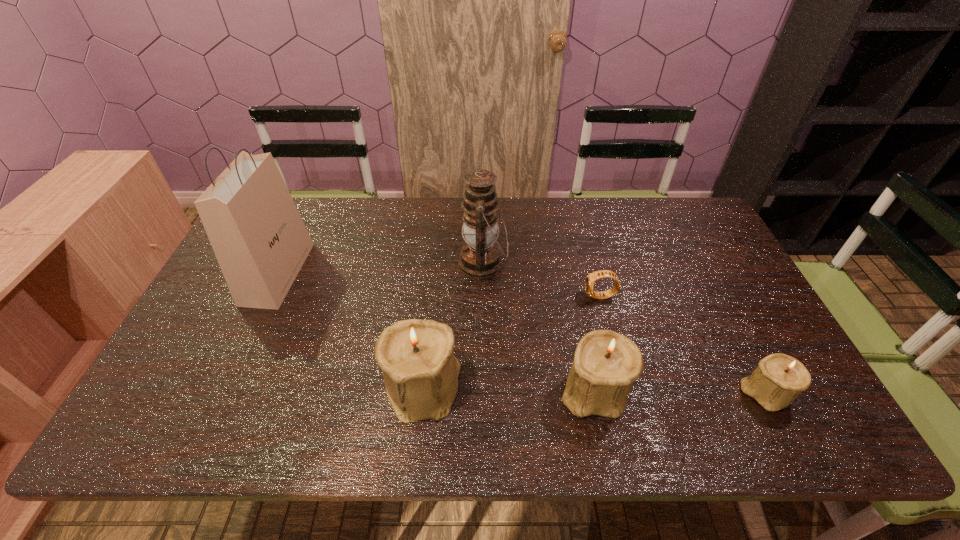
Image resolution: width=960 pixels, height=540 pixels. What are the coordinates of `object that is at the near right corner` in the screenshot? It's located at (778, 379).

I want to click on vacant region at the far edge, so coord(589,211).

In the image, there is a desktop. Where is `vacant space at the near edge`? This screenshot has width=960, height=540. vacant space at the near edge is located at coordinates (644, 387).

Find the location of a particular element. The height and width of the screenshot is (540, 960). free region at the left edge of the desktop is located at coordinates (235, 339).

This screenshot has height=540, width=960. In order to click on free location at the right edge of the desktop in this screenshot , I will do `click(715, 318)`.

Find the location of `free space at the near left corner of the desktop`. free space at the near left corner of the desktop is located at coordinates (201, 377).

This screenshot has height=540, width=960. In order to click on free space at the far right corner of the desktop in this screenshot , I will do `click(690, 232)`.

The height and width of the screenshot is (540, 960). Find the location of `vacant area that lies between the leftmost candle_holder and the watch`. vacant area that lies between the leftmost candle_holder and the watch is located at coordinates (512, 342).

This screenshot has width=960, height=540. Identify the location of free spot between the fifth shortest object and the third shortest object. (539, 326).

Identify the location of free space between the watch and the shortest candle_holder. (684, 345).